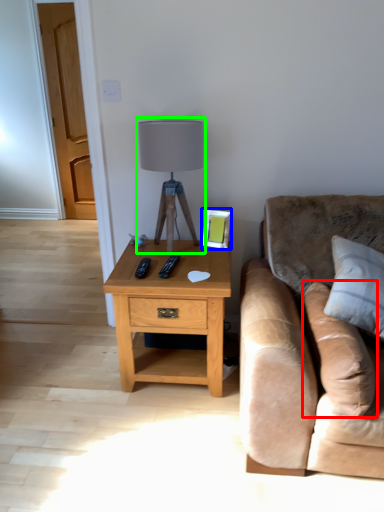
Question: Which object is the closest to the pillow (highlighted by a red box)? Choose among these: picture frame (highlighted by a blue box) or table lamp (highlighted by a green box).

Choices:
 (A) picture frame
 (B) table lamp

Answer: (A)